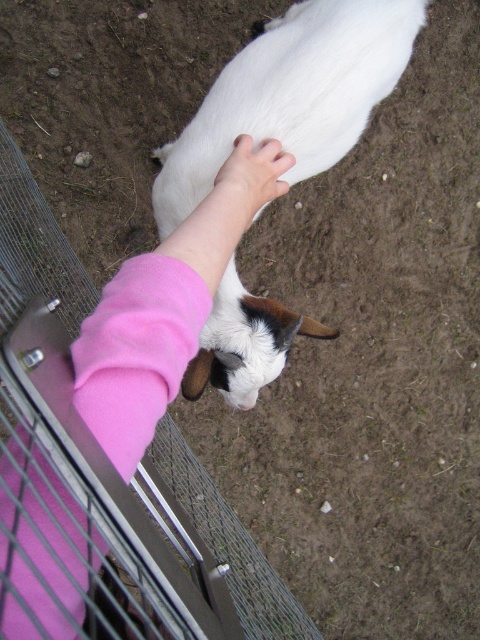
Question: Does white soft lamb at center lie in front of pink soft hand at center?

Choices:
 (A) no
 (B) yes

Answer: (A)

Question: Estimate the real-world distances between objects in this image. Which object is farther from the white soft lamb at center?

Choices:
 (A) pink soft hand at center
 (B) pink fleece sleeve at center

Answer: (B)

Question: Which object appears closest to the camera in this image?

Choices:
 (A) white soft lamb at center
 (B) pink fleece sleeve at center
 (C) pink soft hand at center

Answer: (B)

Question: Which of the following is the closest to the observer?

Choices:
 (A) pink soft hand at center
 (B) pink fleece sleeve at center
 (C) white soft lamb at center

Answer: (B)

Question: Can you confirm if pink fleece sleeve at center is thinner than white soft lamb at center?

Choices:
 (A) no
 (B) yes

Answer: (B)

Question: Can you confirm if pink fleece sleeve at center is thinner than pink soft hand at center?

Choices:
 (A) no
 (B) yes

Answer: (A)